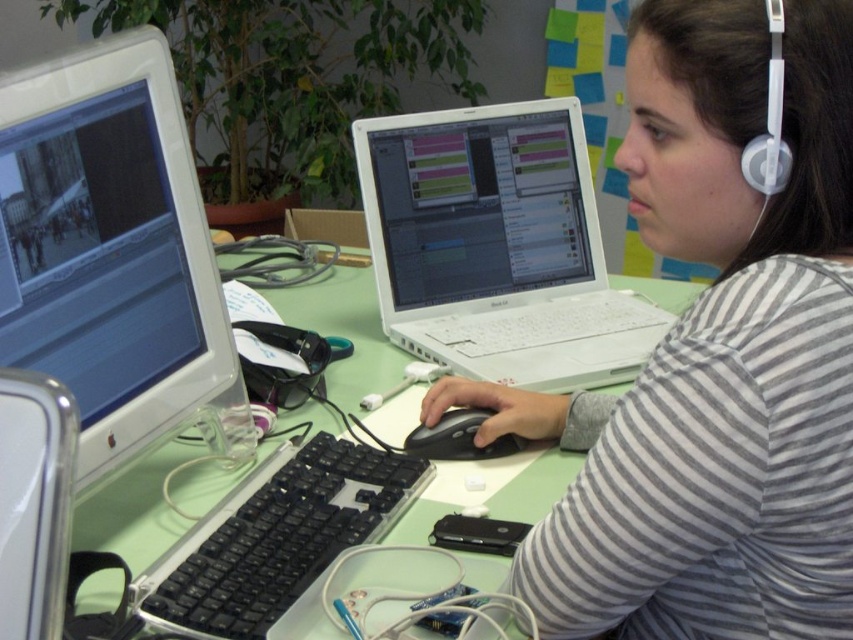
You are a delivery robot that needs to place a small package between the white plastic laptop at center and the green plastic table at center. The package requires 8 inches of space. Is there enough space between them?

The distance between the white plastic laptop at center and the green plastic table at center is 9.35 inches, which is more than the required 8 inches. Therefore, there is enough space to place the small package between them.

You are a virtual assistant trying to identify the position of the gray striped shirt at center relative to the desk. Based on the coordinates provided in the Objects Description, can you determine if the shirt is closer to the left edge or the right edge of the desk?

The gray striped shirt at center is located at point (712, 356). Since the x coordinate is 0.558, which is slightly to the right of the center point 0.5, the shirt is closer to the right edge of the desk.

You are organizing a desk and need to know which object takes up more space to decide where to place them. Which one is larger in size between the gray striped shirt at center and the white plastic laptop at center?

The white plastic laptop at center is larger in size than the gray striped shirt at center because the gray striped shirt at center occupies less space than the white plastic laptop at center.